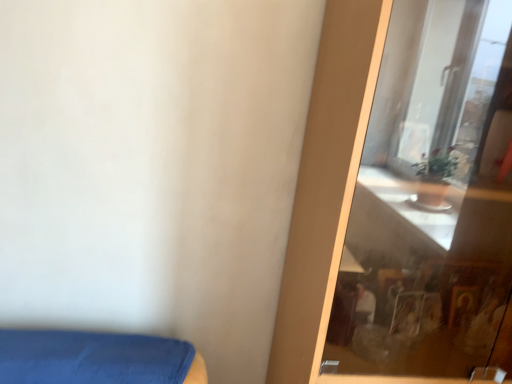
You are a GUI agent. You are given a task and a screenshot of the screen. Output one action in this format:
    pyautogui.click(x=<x>, y=<y>)
    Task: Click on the transparent glass window at upper right
    
    Given the screenshot: What is the action you would take?
    pyautogui.click(x=431, y=198)

This screenshot has height=384, width=512. What do you see at coordinates (431, 198) in the screenshot? I see `transparent glass window at upper right` at bounding box center [431, 198].

The width and height of the screenshot is (512, 384). Identify the location of transparent glass window at upper right. 431,198.